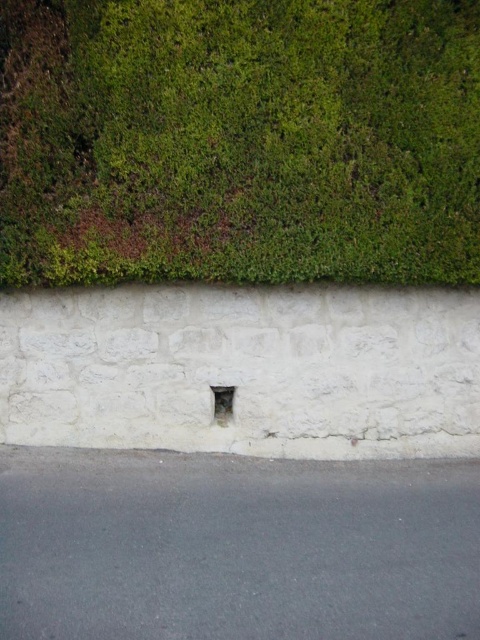
Does green mossy hedge at upper center appear under white stone hole at center?

No, green mossy hedge at upper center is not below white stone hole at center.

Which is in front, point (224, 10) or point (214, 397)?

Point (224, 10) is more forward.

Locate an element on the screen. This screenshot has width=480, height=640. green mossy hedge at upper center is located at coordinates (239, 140).